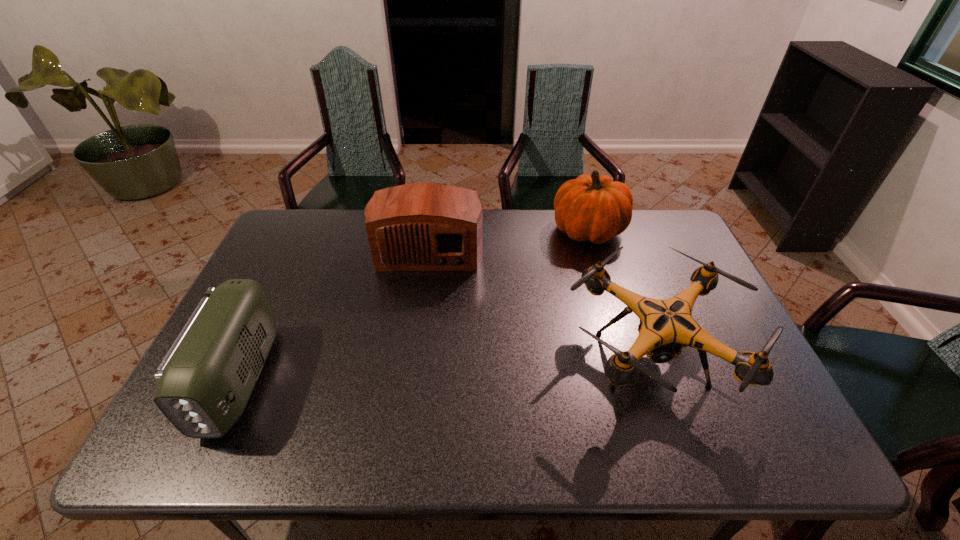
In order to click on drone located in the near edge section of the desktop in this screenshot , I will do `click(666, 326)`.

This screenshot has width=960, height=540. In order to click on radio_receiver that is at the near edge in this screenshot , I will do `click(204, 382)`.

Where is `object that is at the left edge`? object that is at the left edge is located at coordinates (204, 382).

I want to click on object that is at the right edge, so click(x=666, y=326).

Locate an element on the screen. object that is at the near left corner is located at coordinates (204, 382).

Locate an element on the screen. object located in the near right corner section of the desktop is located at coordinates 666,326.

This screenshot has height=540, width=960. I want to click on vacant space at the far edge, so 344,225.

The height and width of the screenshot is (540, 960). I want to click on vacant space at the left edge of the desktop, so click(284, 273).

Locate an element on the screen. This screenshot has width=960, height=540. vacant region at the right edge of the desktop is located at coordinates (659, 269).

This screenshot has width=960, height=540. In the image, there is a desktop. Find the location of `vacant space at the far right corner`. vacant space at the far right corner is located at coordinates (655, 217).